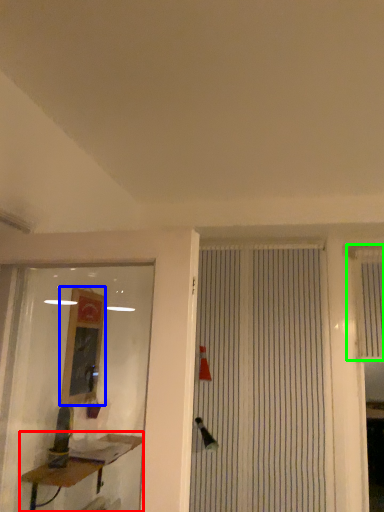
Question: Based on their relative distances, which object is nearer to table (highlighted by a red box)? Choose from job (highlighted by a blue box) and shutter (highlighted by a green box).

Choices:
 (A) job
 (B) shutter

Answer: (A)